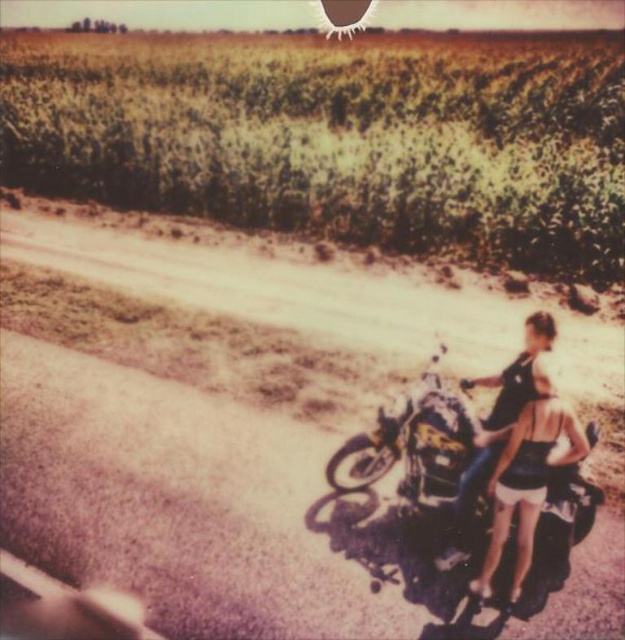
You are a photographer standing at the edge of the cornfield. You want to take a photo of the shiny chrome motorcycle at lower right and the denim shorts at lower right. Which object should you focus on first if you want to capture both in the same frame without moving your camera?

The shiny chrome motorcycle at lower right is larger in size than the denim shorts at lower right, so you should focus on the shiny chrome motorcycle at lower right first as it takes up more space in the frame.

You are a photographer wanting to capture the shiny chrome motorcycle at lower right and the denim shorts at lower right in a single frame. Based on their positions, which object should appear higher in the photo?

The shiny chrome motorcycle at lower right is located above denim shorts at lower right, so it will appear higher in the photo.